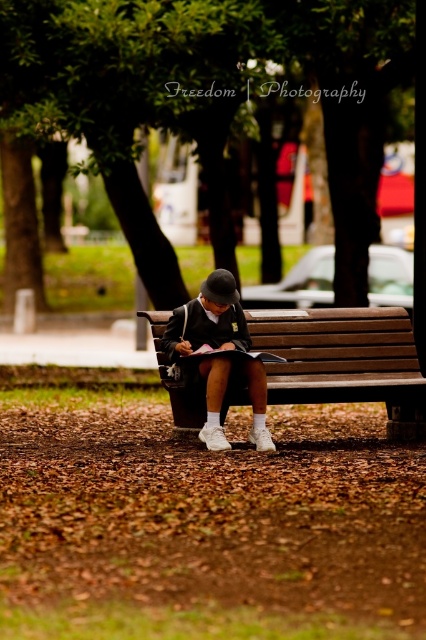
Does brown wooden bench at center appear on the left side of white matte uniform at center?

Incorrect, brown wooden bench at center is not on the left side of white matte uniform at center.

Does point (287, 378) come closer to viewer compared to point (213, 330)?

No.

Locate an element on the screen. The width and height of the screenshot is (426, 640). brown wooden bench at center is located at coordinates (345, 360).